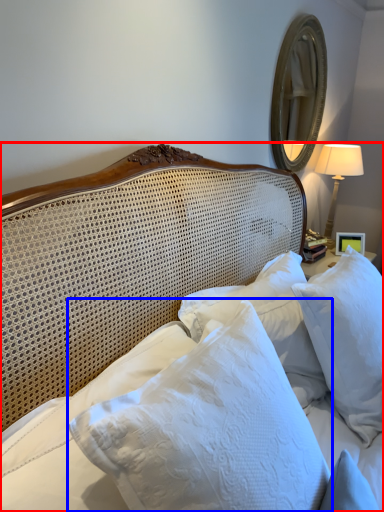
Question: Which object appears farthest to the camera in this image, bed (highlighted by a red box) or pillow (highlighted by a blue box)?

Choices:
 (A) bed
 (B) pillow

Answer: (B)